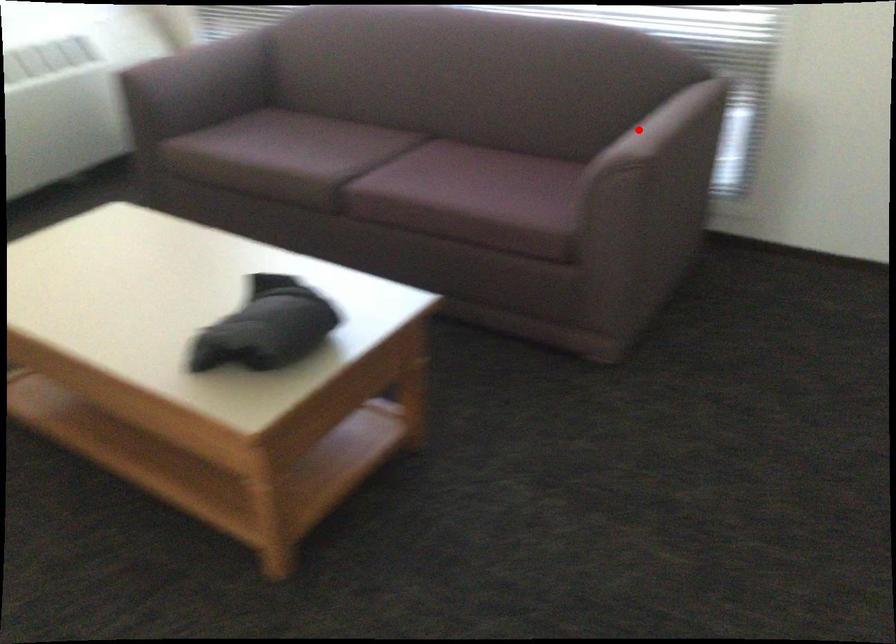
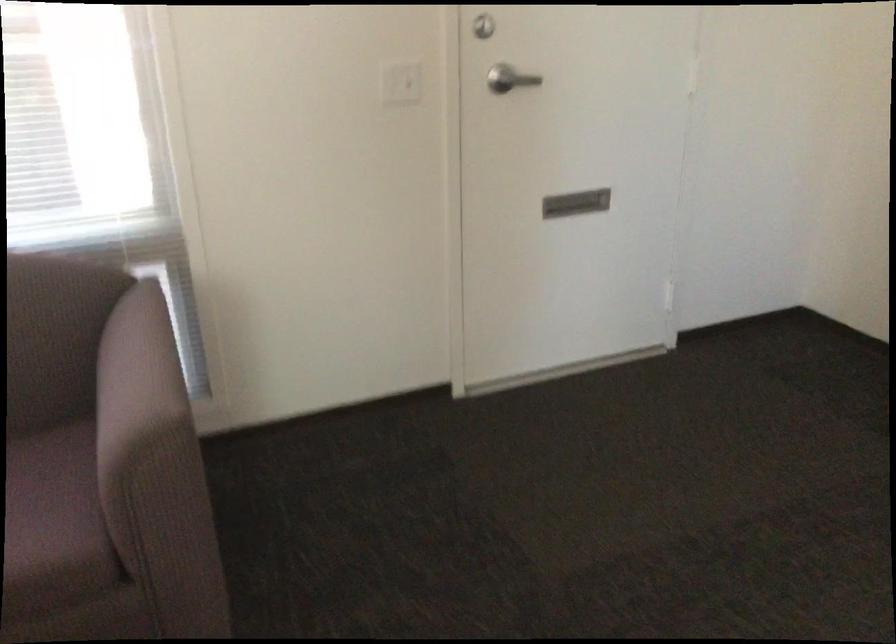
Where in the second image is the point corresponding to the highlighted location from the first image?

(136, 381)